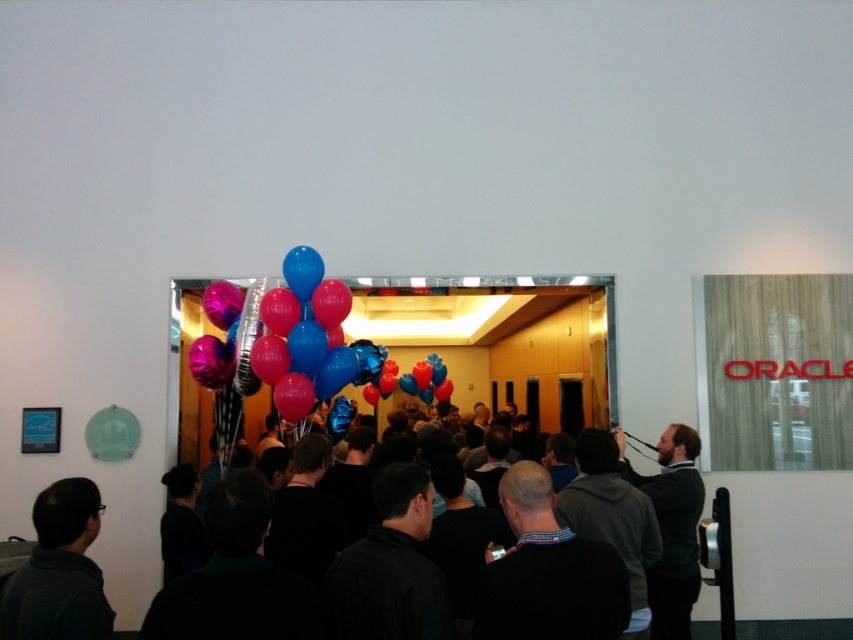
You are standing in the doorway and see a point marked at coordinates (x=281, y=337). Which object is this point located on?

The point is located on the shiny metallic balloons at center.

You are a photographer at the event and need to take a group photo of the people in dark gray clothing at center. The shiny metallic balloons at center might be distracting. Can you suggest a way to avoid the balloons being in the frame?

Since the shiny metallic balloons at center is shorter than dark gray clothing at center, you can adjust the camera angle to look upward, focusing on the taller dark gray clothing at center while the shorter balloons at center will be out of the frame below.